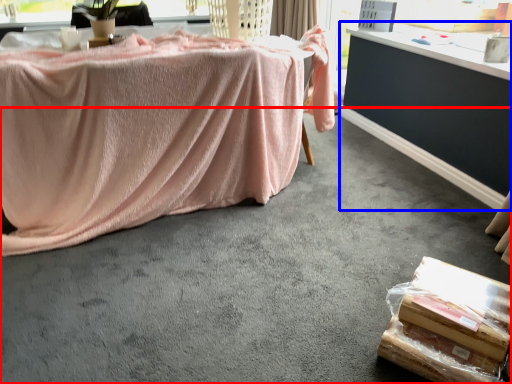
Question: Which of the following is the farthest to the observer, concrete (highlighted by a red box) or table (highlighted by a blue box)?

Choices:
 (A) concrete
 (B) table

Answer: (B)